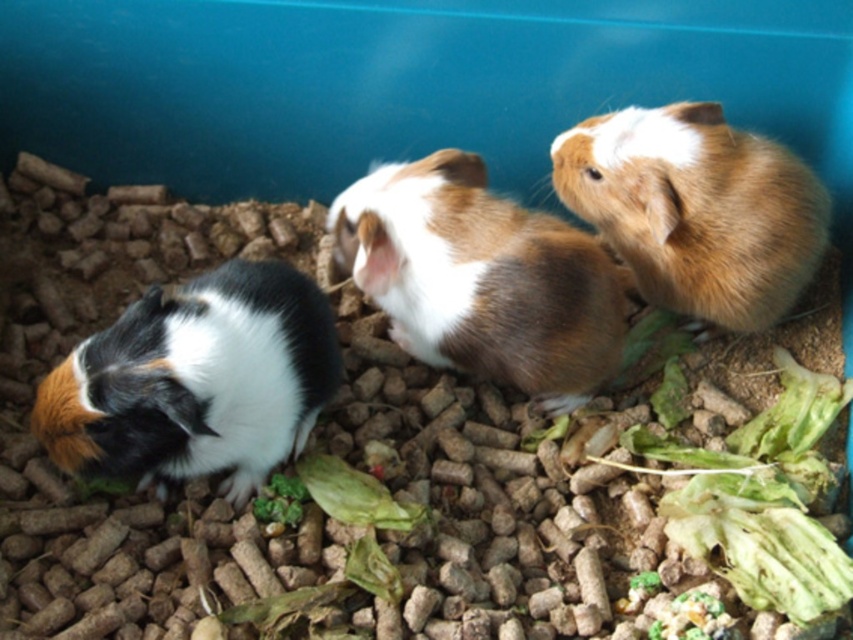
You are a pet owner who wants to place a small toy between the black and white fur hamster at left and the brown fuzzy hamster at center. Based on their sizes, which hamster will have more space between them and the toy?

The black and white fur hamster at left has a smaller width than the brown fuzzy hamster at center, so placing the toy closer to the smaller hamster would leave more space between the toy and the larger hamster.

You are observing the guinea pigs in the blue plastic container. Which of the two hamsters, the brown fuzzy hamster at center or the brown furry hamster at upper right, is positioned more to the left?

The brown fuzzy hamster at center is positioned more to the left than the brown furry hamster at upper right.

You are a small animal caretaker who needs to place a divider between the black and white fur hamster at left and the brown fuzzy hamster at center. The divider is 25 centimeters wide. Will the divider fit between them without overlapping?

The distance between the black and white fur hamster at left and the brown fuzzy hamster at center is 27.41 centimeters. Since the divider is 25 centimeters wide, there will be 2.41 centimeters of space remaining. Therefore, the divider can fit between them without overlapping.